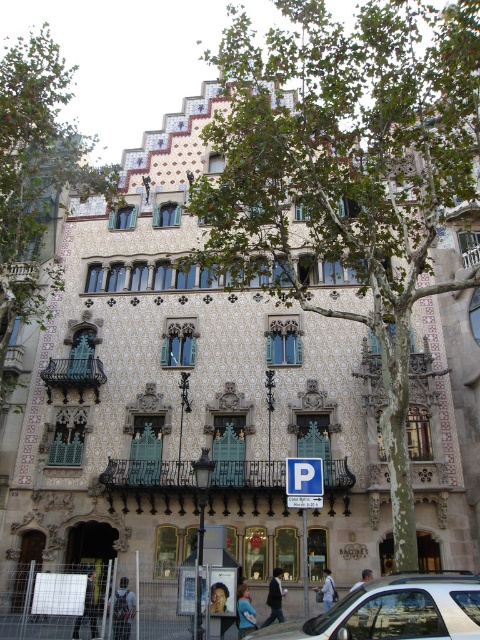
Consider the image. Which is more to the left, dark gray fabric backpack at lower left or blue denim jacket at lower center?

From the viewer's perspective, dark gray fabric backpack at lower left appears more on the left side.

Which of these two, dark gray fabric backpack at lower left or blue denim jacket at lower center, stands taller?

blue denim jacket at lower center is taller.

Between point (124, 600) and point (252, 614), which one is positioned behind?

Point (124, 600)

At what (x,y) coordinates should I click in order to perform the action: click on dark gray fabric backpack at lower left. Please return your answer as a coordinate pair (x, y). Looking at the image, I should click on (122, 611).

Can you confirm if dark gray fabric backpack at lower left is thinner than light blue denim jacket at lower left?

Indeed, dark gray fabric backpack at lower left has a lesser width compared to light blue denim jacket at lower left.

Does dark gray fabric backpack at lower left appear over light blue denim jacket at lower left?

Indeed, dark gray fabric backpack at lower left is positioned over light blue denim jacket at lower left.

What do you see at coordinates (122, 611) in the screenshot? The height and width of the screenshot is (640, 480). I see `dark gray fabric backpack at lower left` at bounding box center [122, 611].

Locate an element on the screen. The height and width of the screenshot is (640, 480). dark gray fabric backpack at lower left is located at coordinates (122, 611).

Is point (273, 570) closer to camera compared to point (328, 580)?

No.

This screenshot has width=480, height=640. Describe the element at coordinates (275, 598) in the screenshot. I see `dark blue jacket at center` at that location.

The width and height of the screenshot is (480, 640). I want to click on dark blue jacket at center, so click(x=275, y=598).